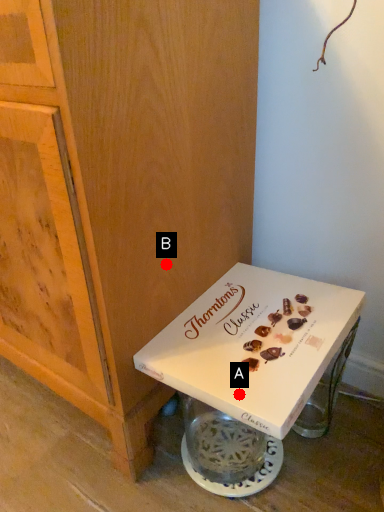
Question: Two points are circled on the image, labeled by A and B beside each circle. Which of the following is the farthest from the observer?

Choices:
 (A) A is further
 (B) B is further

Answer: (B)